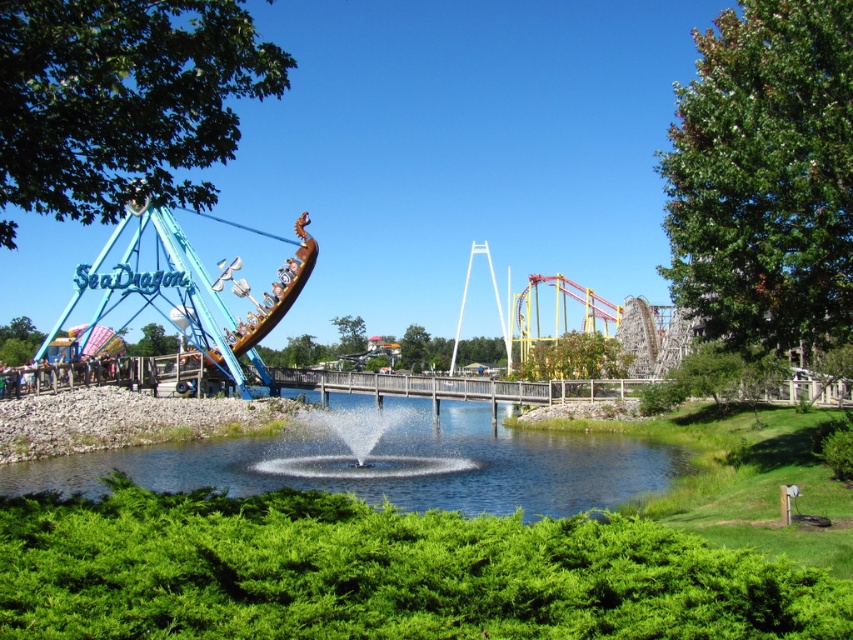
Question: From the image, what is the correct spatial relationship of clear water at center in relation to rusty metal boat at left?

Choices:
 (A) left
 (B) right

Answer: (B)

Question: Does clear water at center lie in front of rusty metal boat at left?

Choices:
 (A) no
 (B) yes

Answer: (A)

Question: Can you confirm if clear water at center is positioned above rusty metal boat at left?

Choices:
 (A) no
 (B) yes

Answer: (A)

Question: Which point is farther from the camera taking this photo?

Choices:
 (A) (236, 336)
 (B) (369, 481)

Answer: (A)

Question: Which point is closer to the camera?

Choices:
 (A) (196, 333)
 (B) (621, 492)

Answer: (B)